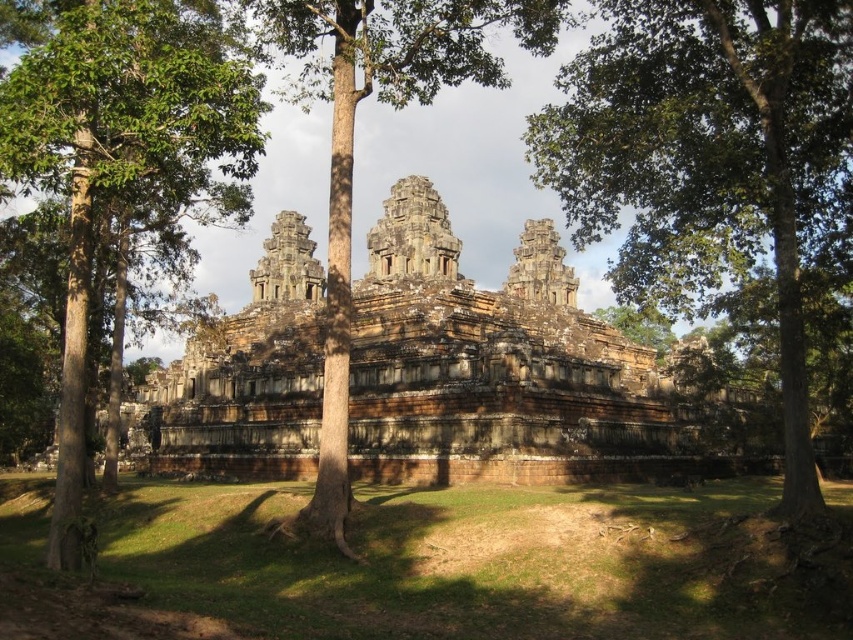
Question: Does brown stone ruins at center appear on the right side of green leafy tree at left?

Choices:
 (A) yes
 (B) no

Answer: (A)

Question: Which of these objects is positioned farthest from the brown wood tree at center?

Choices:
 (A) brown stone ruins at center
 (B) green leafy tree at center
 (C) green leafy tree at left

Answer: (A)

Question: Among these objects, which one is farthest from the camera?

Choices:
 (A) green leafy tree at center
 (B) brown stone ruins at center

Answer: (B)

Question: Estimate the real-world distances between objects in this image. Which object is closer to the brown wood tree at center?

Choices:
 (A) brown stone ruins at center
 (B) green leafy tree at center
 (C) green leafy tree at upper center

Answer: (B)

Question: Does brown stone ruins at center appear under green leafy tree at center?

Choices:
 (A) yes
 (B) no

Answer: (A)

Question: Does brown wood tree at center appear over green leafy tree at upper center?

Choices:
 (A) yes
 (B) no

Answer: (A)